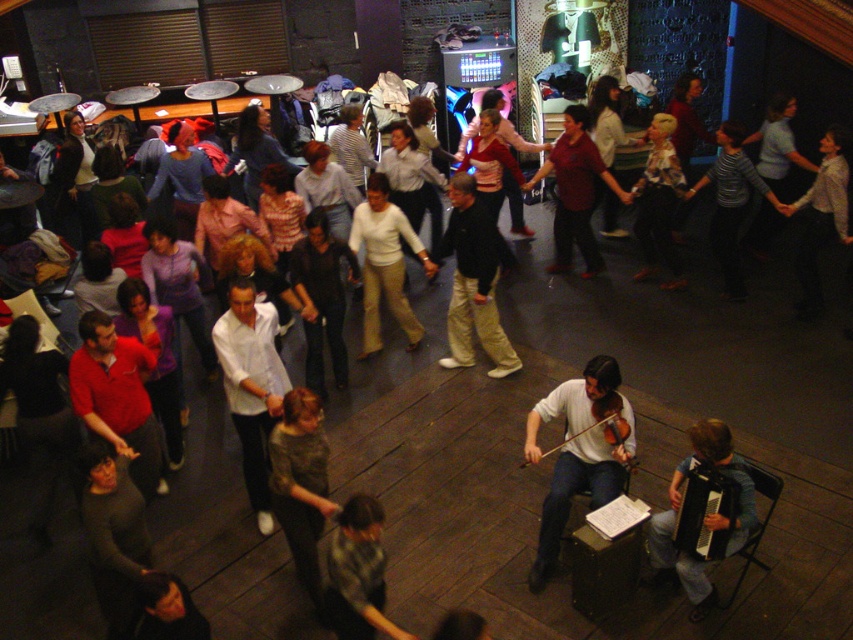
You are at the ceilidh dance and want to move from your current position to the gray fabric dress at lower center. There is an obstacle near the light beige pants at center. Is the obstacle in your path to the dress?

The light beige pants at center is further to the viewer than the gray fabric dress at lower center, so the obstacle near the light beige pants at center is actually behind the gray fabric dress at lower center. Therefore, the obstacle is not in your path to the gray fabric dress at lower center.

You are a photographer at the event and want to capture a photo of both the light beige pants at center and the gray fabric dress at lower center. Since you want to focus on the details of both, which object should you zoom in on more to ensure it takes up more space in the photo?

The light beige pants at center has a larger width than the gray fabric dress at lower center, so you should zoom in more on the light beige pants at center to ensure it takes up more space in the photo.

You are a photographer at the back of the room wanting to take a photo of the matte red shirt at center without the gray fabric shirt at lower center blocking it. What should you do?

Move to a position behind the gray fabric shirt at lower center so that the matte red shirt at center is visible behind it. Since the gray fabric shirt at lower center is in front of the matte red shirt at center, moving behind the gray fabric shirt at lower center will allow you to capture the matte red shirt at center without obstruction.